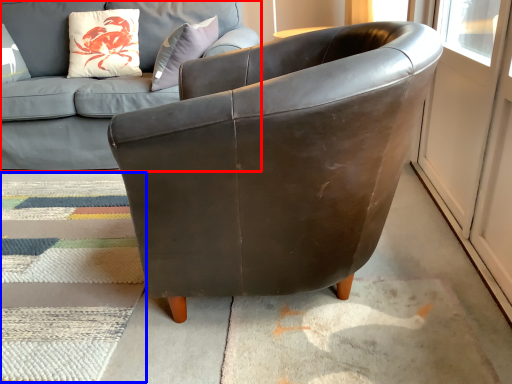
Question: Which of the following is the farthest to the observer, studio couch (highlighted by a red box) or mat (highlighted by a blue box)?

Choices:
 (A) studio couch
 (B) mat

Answer: (A)